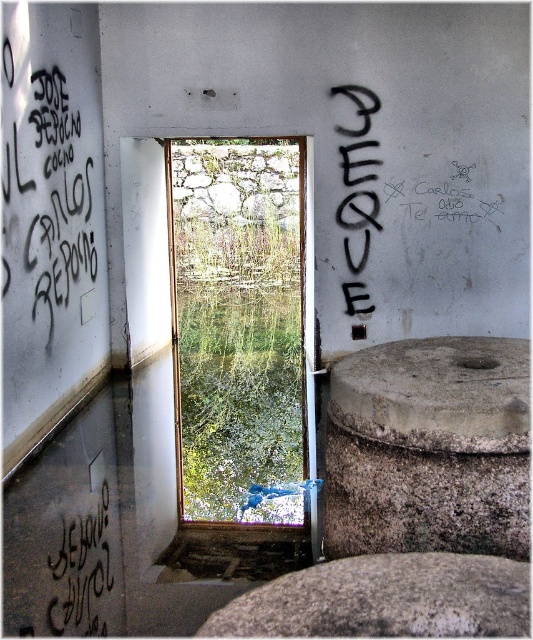
You are a maintenance worker needing to reach both the gray rough stone at lower right and the black graffiti at upper right. Given that your ladder is 12 feet long, can you safely reach both objects with the ladder without moving it?

The distance between the gray rough stone at lower right and the black graffiti at upper right is 14.68 feet. Since the ladder is only 12 feet long, it cannot span the entire distance between them. Therefore, you would need to move the ladder to reach both objects safely.